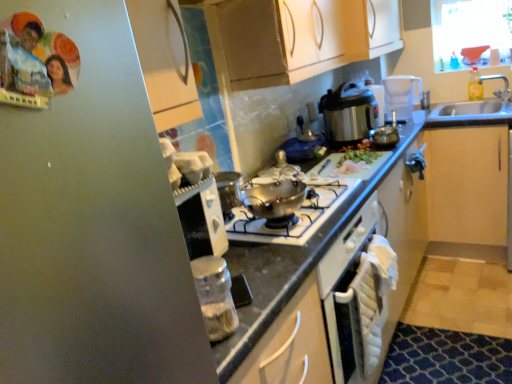
This screenshot has height=384, width=512. I want to click on free space behind clear glass jar at lower center, positioned as the 1th kitchen appliance in bottom-to-top order, so click(x=257, y=279).